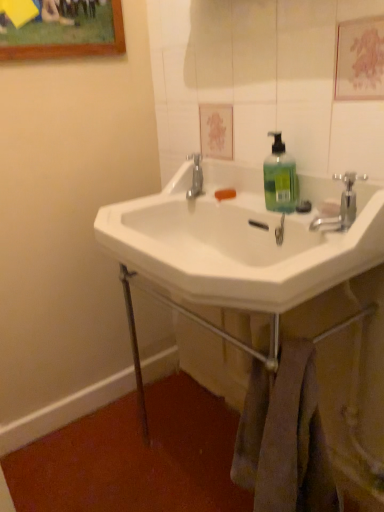
This screenshot has width=384, height=512. Describe the element at coordinates (315, 402) in the screenshot. I see `white ceramic sink at center` at that location.

Where is `white ceramic sink at center`? white ceramic sink at center is located at coordinates (238, 242).

Locate an element on the screen. The height and width of the screenshot is (512, 384). white glossy mirror at upper center is located at coordinates (261, 81).

I want to click on chrome metallic faucet at upper right, so click(341, 206).

This screenshot has width=384, height=512. What do you see at coordinates (280, 178) in the screenshot? I see `green translucent liquid at center` at bounding box center [280, 178].

Identify the location of white ceramic sink at center. This screenshot has height=512, width=384. (315, 402).

Is the position of white ceramic sink at center more distant than that of white glossy mirror at upper center?

That is True.

In the image, is white ceramic sink at center on the left side or the right side of white glossy mirror at upper center?

Clearly, white ceramic sink at center is on the left of white glossy mirror at upper center in the image.

Is white ceramic sink at center wider or thinner than white glossy mirror at upper center?

Clearly, white ceramic sink at center has more width compared to white glossy mirror at upper center.

The height and width of the screenshot is (512, 384). I want to click on tap above the white ceramic sink at center (from the image's perspective), so click(341, 206).

From the image's perspective, which is below, chrome metallic faucet at upper right or white ceramic sink at center?

white ceramic sink at center appears lower in the image.

Is chrome metallic faucet at upper right in front of or behind white ceramic sink at center in the image?

Clearly, chrome metallic faucet at upper right is behind white ceramic sink at center.

How much distance is there between chrome metallic faucet at upper right and white ceramic sink at center?

9.13 inches.

Consider the image. Which object is thinner, white ceramic sink at center or white ceramic sink at center?

With smaller width is white ceramic sink at center.

From a real-world perspective, does white ceramic sink at center stand above white ceramic sink at center?

Yes, from a real-world perspective, white ceramic sink at center is above white ceramic sink at center.

Considering their positions, is white ceramic sink at center located in front of or behind white ceramic sink at center?

white ceramic sink at center is positioned closer to the viewer than white ceramic sink at center.

Is point (308, 264) positioned behind point (349, 325)?

No.

Is green translucent liquid at center smaller than chrome metallic faucet at upper right?

Indeed, green translucent liquid at center has a smaller size compared to chrome metallic faucet at upper right.

How distant is green translucent liquid at center from chrome metallic faucet at upper right?

green translucent liquid at center is 14.87 centimeters from chrome metallic faucet at upper right.

Can you confirm if green translucent liquid at center is taller than chrome metallic faucet at upper right?

Correct, green translucent liquid at center is much taller as chrome metallic faucet at upper right.

From a real-world perspective, is green translucent liquid at center located higher than chrome metallic faucet at upper right?

Yes, from a real-world perspective, green translucent liquid at center is on top of chrome metallic faucet at upper right.

Could you tell me if white glossy mirror at upper center is facing chrome metallic faucet at upper right?

Yes, white glossy mirror at upper center is turned towards chrome metallic faucet at upper right.

What's the angular difference between white glossy mirror at upper center and chrome metallic faucet at upper right's facing directions?

0.465 degrees.

In the scene shown: Who is smaller, white glossy mirror at upper center or chrome metallic faucet at upper right?

chrome metallic faucet at upper right is smaller.

Would you consider chrome metallic faucet at upper right to be distant from white glossy mirror at upper center?

No, chrome metallic faucet at upper right is in close proximity to white glossy mirror at upper center.

Is white glossy mirror at upper center at the back of chrome metallic faucet at upper right?

Yes, white glossy mirror at upper center is at the back of chrome metallic faucet at upper right.

Which is less distant, (342, 175) or (204, 102)?

Positioned in front is point (342, 175).

Is white ceramic sink at center completely or partially outside of white ceramic sink at center?

Yes, white ceramic sink at center is located beyond the bounds of white ceramic sink at center.

From a real-world perspective, is white ceramic sink at center over white ceramic sink at center?

No.

Which is in front, point (356, 358) or point (135, 259)?

The point (135, 259) is closer to the camera.

Is white ceramic sink at center to the left or to the right of white ceramic sink at center in the image?

Based on their positions, white ceramic sink at center is located to the right of white ceramic sink at center.

Find the location of a particular element. This screenshot has width=384, height=512. counter on the left of white glossy mirror at upper center is located at coordinates (315, 402).

This screenshot has height=512, width=384. Find the location of `tap on the right of white ceramic sink at center`. tap on the right of white ceramic sink at center is located at coordinates (341, 206).

Looking at the image, which one is located closer to white ceramic sink at center, green translucent liquid at center or white ceramic sink at center?

white ceramic sink at center.

Considering their positions, is white glossy mirror at upper center positioned closer to white ceramic sink at center than green translucent liquid at center?

green translucent liquid at center is closer to white ceramic sink at center.

Estimate the real-world distances between objects in this image. Which object is closer to white ceramic sink at center, green translucent liquid at center or white glossy mirror at upper center?

The object closer to white ceramic sink at center is green translucent liquid at center.

When comparing their distances from green translucent liquid at center, does white ceramic sink at center or chrome metallic faucet at upper right seem further?

Among the two, white ceramic sink at center is located further to green translucent liquid at center.

From the image, which object appears to be nearer to chrome metallic faucet at upper right, white ceramic sink at center or white glossy mirror at upper center?

The object closer to chrome metallic faucet at upper right is white ceramic sink at center.

Based on their spatial positions, is white glossy mirror at upper center or chrome metallic faucet at upper right closer to green translucent liquid at center?

chrome metallic faucet at upper right is positioned closer to the anchor green translucent liquid at center.

From the image, which object appears to be farther from chrome metallic faucet at upper right, white glossy mirror at upper center or white ceramic sink at center?

white glossy mirror at upper center is further to chrome metallic faucet at upper right.

Looking at the image, which one is located closer to green translucent liquid at center, white ceramic sink at center or white ceramic sink at center?

white ceramic sink at center.

This screenshot has width=384, height=512. In order to click on tap between green translucent liquid at center and white ceramic sink at center from top to bottom in this screenshot , I will do `click(341, 206)`.

At what (x,y) coordinates should I click in order to perform the action: click on sink between chrome metallic faucet at upper right and white ceramic sink at center in the up-down direction. Please return your answer as a coordinate pair (x, y). Looking at the image, I should click on (238, 242).

In order to click on sink between white glossy mirror at upper center and white ceramic sink at center vertically in this screenshot , I will do `click(238, 242)`.

Find the location of a particular element. The width and height of the screenshot is (384, 512). tap that lies between white glossy mirror at upper center and white ceramic sink at center from top to bottom is located at coordinates (x=341, y=206).